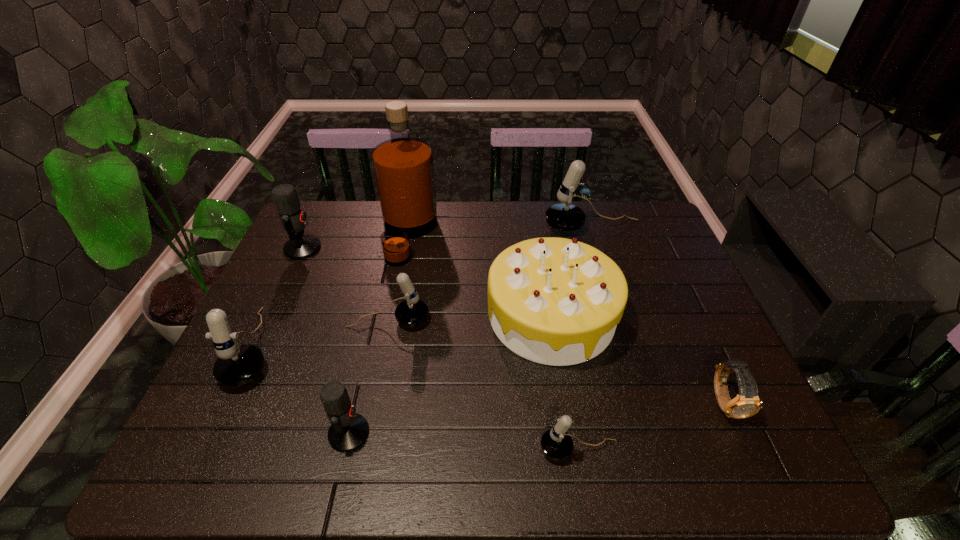
Locate an element on the screen. the nearest white microphone is located at coordinates (556, 443).

What are the coordinates of `watch` in the screenshot? It's located at (747, 403).

Locate an element on the screen. The height and width of the screenshot is (540, 960). vacant space situated on the front label of the tallest object is located at coordinates (510, 235).

This screenshot has height=540, width=960. I want to click on vacant region located on the left of the biggest white microphone, so click(529, 227).

At what (x,y) coordinates should I click in order to perform the action: click on free region located on the side of the left red microphone with the red ring. Please return your answer as a coordinate pair (x, y). The width and height of the screenshot is (960, 540). Looking at the image, I should click on (406, 248).

This screenshot has width=960, height=540. What are the coordinates of `vacant region located on the right of the birthday cake` in the screenshot? It's located at (708, 316).

Where is `vacant space located 0.090m on the back of the leftmost white microphone`? This screenshot has width=960, height=540. vacant space located 0.090m on the back of the leftmost white microphone is located at coordinates (286, 285).

Where is `free space located on the left of the third biggest white microphone`? The height and width of the screenshot is (540, 960). free space located on the left of the third biggest white microphone is located at coordinates (292, 320).

Locate an element on the screen. The width and height of the screenshot is (960, 540). free spot located on the side of the right red microphone with the red ring is located at coordinates (515, 433).

Locate an element on the screen. The height and width of the screenshot is (540, 960). free space located 0.120m on the left of the smallest white microphone is located at coordinates click(x=482, y=449).